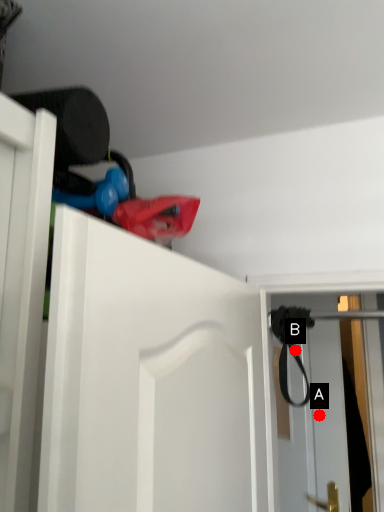
Question: Two points are circled on the image, labeled by A and B beside each circle. Which point appears closest to the camera in this image?

Choices:
 (A) A is closer
 (B) B is closer

Answer: (B)